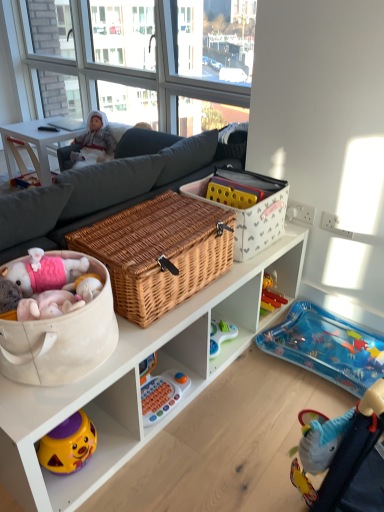
Describe the element at coordinates (257, 213) in the screenshot. I see `white wicker basket at upper center, which is counted as the second storage box, starting from the front` at that location.

The height and width of the screenshot is (512, 384). Identify the location of woven wood basket at center. (137, 380).

This screenshot has height=512, width=384. What do you see at coordinates (131, 68) in the screenshot?
I see `transparent glass window at upper center` at bounding box center [131, 68].

Find the location of a particular element. Image resolution: width=384 pixels, height=512 pixels. transparent glass window at upper center is located at coordinates (131, 68).

Measure the distance between point (127, 252) and camera.

They are 4.18 feet apart.

Describe the element at coordinates (159, 252) in the screenshot. This screenshot has width=384, height=512. I see `woven brown picnic basket at center` at that location.

Locate an element on the screen. This screenshot has height=512, width=384. white wicker basket at upper center, acting as the 1th storage box starting from the right is located at coordinates (257, 213).

From a real-world perspective, is orange plastic toy at center located beneath transparent plastic infant bed at lower right?

No, from a real-world perspective, orange plastic toy at center is not under transparent plastic infant bed at lower right.

Which point is more forward, (149, 415) or (271, 351)?

Positioned in front is point (149, 415).

Who is bigger, orange plastic toy at center or transparent plastic infant bed at lower right?

Bigger between the two is transparent plastic infant bed at lower right.

Considering the sizes of objects orange plastic toy at center and transparent plastic infant bed at lower right in the image provided, who is thinner, orange plastic toy at center or transparent plastic infant bed at lower right?

With smaller width is orange plastic toy at center.

Considering the relative sizes of transparent glass window at upper center and blue fabric baby carriage at lower right in the image provided, is transparent glass window at upper center shorter than blue fabric baby carriage at lower right?

In fact, transparent glass window at upper center may be taller than blue fabric baby carriage at lower right.

Locate an element on the screen. The width and height of the screenshot is (384, 512). window screen that is on the left side of blue fabric baby carriage at lower right is located at coordinates (131, 68).

From a real-world perspective, which object stands above the other?

transparent glass window at upper center.

Considering the relative positions of beige fabric basket at lower left, which appears as the second storage box when viewed from the right, and transparent glass window at upper center in the image provided, is beige fabric basket at lower left, which appears as the second storage box when viewed from the right, to the left of transparent glass window at upper center from the viewer's perspective?

In fact, beige fabric basket at lower left, which appears as the second storage box when viewed from the right, is to the right of transparent glass window at upper center.

Based on the photo, how distant is beige fabric basket at lower left, which is counted as the 1th storage box, starting from the front, from transparent glass window at upper center?

beige fabric basket at lower left, which is counted as the 1th storage box, starting from the front, and transparent glass window at upper center are 6.80 feet apart from each other.

How many degrees apart are the facing directions of beige fabric basket at lower left, which appears as the second storage box when viewed from the right, and transparent glass window at upper center?

They differ by 94.5 degrees in their facing directions.

Would you say beige fabric basket at lower left, the 2th storage box when ordered from back to front, is outside transparent glass window at upper center?

beige fabric basket at lower left, the 2th storage box when ordered from back to front, is positioned outside transparent glass window at upper center.

From the image's perspective, is beige fabric basket at lower left, which appears as the second storage box when viewed from the right, over blue fabric baby carriage at lower right?

Yes.

Considering the positions of points (44, 376) and (354, 473), is point (44, 376) farther from camera compared to point (354, 473)?

That is True.

Considering the sizes of objects beige fabric basket at lower left, which is counted as the 1th storage box, starting from the front, and blue fabric baby carriage at lower right in the image provided, who is thinner, beige fabric basket at lower left, which is counted as the 1th storage box, starting from the front, or blue fabric baby carriage at lower right?

blue fabric baby carriage at lower right is thinner.

How different are the orientations of beige fabric basket at lower left, which is the first storage box in left-to-right order, and blue fabric baby carriage at lower right in degrees?

There is a 177-degree angle between the facing directions of beige fabric basket at lower left, which is the first storage box in left-to-right order, and blue fabric baby carriage at lower right.

Relative to transparent glass window at upper center, is white wicker basket at upper center, acting as the 1th storage box starting from the right, in front or behind?

Visually, white wicker basket at upper center, acting as the 1th storage box starting from the right, is located in front of transparent glass window at upper center.

Considering the positions of objects white wicker basket at upper center, the 2th storage box in the left-to-right sequence, and transparent glass window at upper center in the image provided, who is more to the right, white wicker basket at upper center, the 2th storage box in the left-to-right sequence, or transparent glass window at upper center?

white wicker basket at upper center, the 2th storage box in the left-to-right sequence, is more to the right.

Measure the distance from white wicker basket at upper center, the 2th storage box in the left-to-right sequence, to transparent glass window at upper center.

A distance of 4.42 feet exists between white wicker basket at upper center, the 2th storage box in the left-to-right sequence, and transparent glass window at upper center.

From a real-world perspective, is white wicker basket at upper center, acting as the 1th storage box starting from the right, positioned over transparent glass window at upper center based on gravity?

No, from a real-world perspective, white wicker basket at upper center, acting as the 1th storage box starting from the right, is not over transparent glass window at upper center

Is white wicker basket at upper center, acting as the 1th storage box starting from the right, turned away from transparent plastic infant bed at lower right?

No, white wicker basket at upper center, acting as the 1th storage box starting from the right, is not facing the opposite direction of transparent plastic infant bed at lower right.

Is white wicker basket at upper center, the first storage box from the back, touching transparent plastic infant bed at lower right?

No, white wicker basket at upper center, the first storage box from the back, is not beside transparent plastic infant bed at lower right.

From the image's perspective, relative to transparent plastic infant bed at lower right, is white wicker basket at upper center, acting as the 1th storage box starting from the right, above or below?

Based on their image positions, white wicker basket at upper center, acting as the 1th storage box starting from the right, is located above transparent plastic infant bed at lower right.

Which of these two, white wicker basket at upper center, the 2th storage box in the left-to-right sequence, or transparent plastic infant bed at lower right, is thinner?

white wicker basket at upper center, the 2th storage box in the left-to-right sequence, is thinner.

Could you tell me if beige fabric basket at lower left, which is counted as the 1th storage box, starting from the front, is turned towards woven brown picnic basket at center?

No, beige fabric basket at lower left, which is counted as the 1th storage box, starting from the front, is not facing towards woven brown picnic basket at center.

Considering the positions of objects beige fabric basket at lower left, which is the first storage box in left-to-right order, and woven brown picnic basket at center in the image provided, who is in front, beige fabric basket at lower left, which is the first storage box in left-to-right order, or woven brown picnic basket at center?

beige fabric basket at lower left, which is the first storage box in left-to-right order.

How far apart are beige fabric basket at lower left, which appears as the second storage box when viewed from the right, and woven brown picnic basket at center?

9.55 inches.

This screenshot has height=512, width=384. Identify the location of toy below the transparent plastic infant bed at lower right (from the image's perspective). (160, 391).

The width and height of the screenshot is (384, 512). In order to click on window screen that appears on the left of blue fabric baby carriage at lower right in this screenshot , I will do `click(131, 68)`.

Looking at the image, which one is located further to blue fabric baby carriage at lower right, transparent glass window at upper center or transparent plastic infant bed at lower right?

transparent glass window at upper center is further to blue fabric baby carriage at lower right.

Which object lies nearer to the anchor point white plush doll at upper left, orange plastic toy at center or transparent plastic infant bed at lower right?

The object closer to white plush doll at upper left is transparent plastic infant bed at lower right.

When comparing their distances from blue fabric baby carriage at lower right, does beige fabric basket at lower left, which is the first storage box in left-to-right order, or transparent plastic infant bed at lower right seem closer?

beige fabric basket at lower left, which is the first storage box in left-to-right order, lies closer to blue fabric baby carriage at lower right than the other object.

From the image, which object appears to be nearer to transparent glass window at upper center, woven brown picnic basket at center or blue fabric baby carriage at lower right?

woven brown picnic basket at center is closer to transparent glass window at upper center.

From the image, which object appears to be nearer to woven wood basket at center, transparent glass window at upper center or white plush doll at upper left?

Based on the image, white plush doll at upper left appears to be nearer to woven wood basket at center.

When comparing their distances from transparent glass window at upper center, does transparent plastic infant bed at lower right or white wooden table at upper left seem further?

transparent plastic infant bed at lower right is positioned further to the anchor transparent glass window at upper center.

From the image, which object appears to be farther from white wooden table at upper left, transparent plastic infant bed at lower right or beige fabric basket at lower left, which is counted as the 1th storage box, starting from the front?

Among the two, transparent plastic infant bed at lower right is located further to white wooden table at upper left.

Considering their positions, is woven brown picnic basket at center positioned closer to woven wood basket at center than transparent plastic infant bed at lower right?

The object closer to woven wood basket at center is woven brown picnic basket at center.

Identify the location of picnic basket between transparent glass window at upper center and orange plastic toy at center from top to bottom. [159, 252].

The image size is (384, 512). Find the location of `toddler between white wicker basket at upper center, which is counted as the second storage box, starting from the front, and white wooden table at upper left, along the z-axis`. toddler between white wicker basket at upper center, which is counted as the second storage box, starting from the front, and white wooden table at upper left, along the z-axis is located at coordinates (95, 141).

Locate an element on the screen. The image size is (384, 512). storage box between transparent glass window at upper center and woven wood basket at center in the vertical direction is located at coordinates (257, 213).

Where is `infant bed that lies between white wicker basket at upper center, the first storage box from the back, and orange plastic toy at center from top to bottom`? infant bed that lies between white wicker basket at upper center, the first storage box from the back, and orange plastic toy at center from top to bottom is located at coordinates (326, 347).